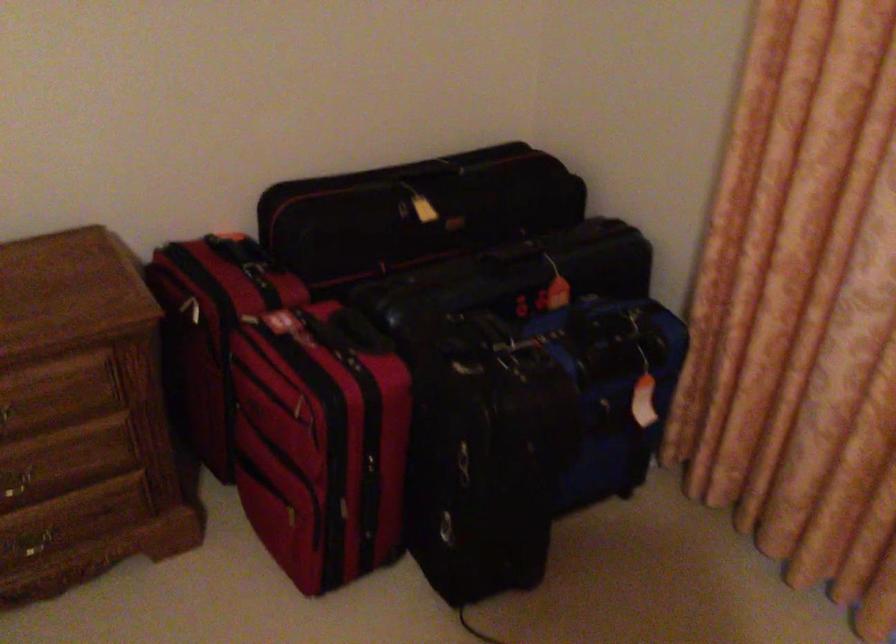
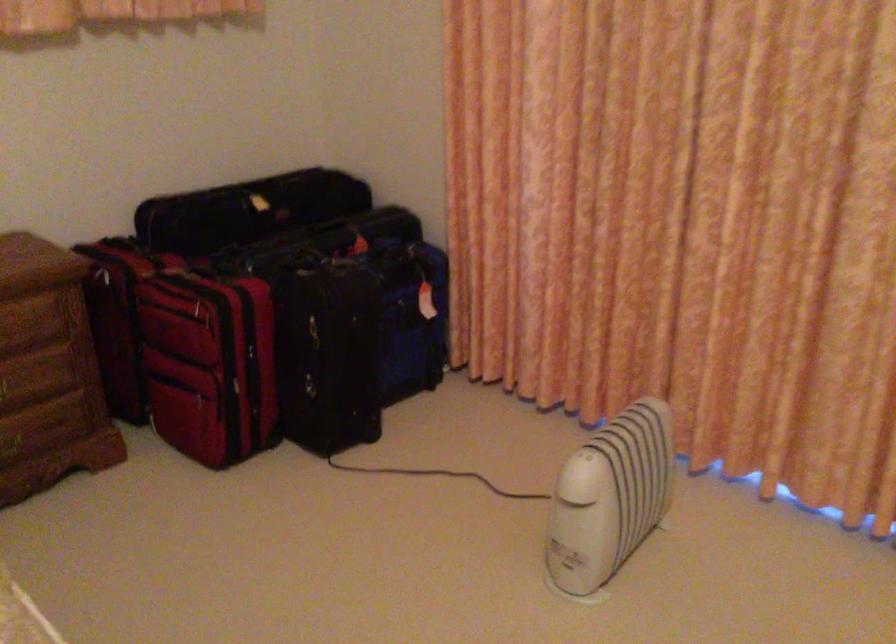
In the second image, find the point that corresponds to [502,353] in the first image.

(330, 266)